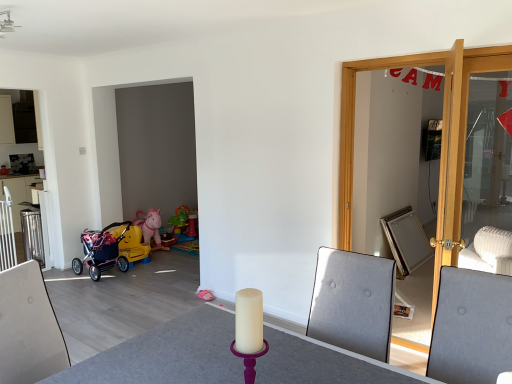
Question: From a real-world perspective, is white matte round table at center positioned under matte white cabinet at upper left based on gravity?

Choices:
 (A) yes
 (B) no

Answer: (A)

Question: Does white matte round table at center have a greater height compared to matte white cabinet at upper left?

Choices:
 (A) yes
 (B) no

Answer: (B)

Question: Is white matte round table at center oriented towards matte white cabinet at upper left?

Choices:
 (A) yes
 (B) no

Answer: (B)

Question: Is white matte round table at center bigger than matte white cabinet at upper left?

Choices:
 (A) no
 (B) yes

Answer: (B)

Question: Is matte white cabinet at upper left completely or partially inside white matte round table at center?

Choices:
 (A) yes
 (B) no

Answer: (B)

Question: Is point (471, 195) positioned closer to the camera than point (12, 135)?

Choices:
 (A) farther
 (B) closer

Answer: (A)

Question: From a real-world perspective, is light wood door at right positioned above or below matte white cabinet at upper left?

Choices:
 (A) below
 (B) above

Answer: (A)

Question: In the image, is light wood door at right positioned in front of or behind matte white cabinet at upper left?

Choices:
 (A) front
 (B) behind

Answer: (A)

Question: From the image's perspective, is light wood door at right positioned above or below matte white cabinet at upper left?

Choices:
 (A) above
 (B) below

Answer: (B)

Question: Is matte white cabinet at upper left wider or thinner than gray fabric swivel chair at right?

Choices:
 (A) wide
 (B) thin

Answer: (B)

Question: Based on their sizes in the image, would you say matte white cabinet at upper left is bigger or smaller than gray fabric swivel chair at right?

Choices:
 (A) small
 (B) big

Answer: (A)

Question: Would you say matte white cabinet at upper left is inside or outside gray fabric swivel chair at right?

Choices:
 (A) outside
 (B) inside

Answer: (A)

Question: Is matte white cabinet at upper left taller or shorter than gray fabric swivel chair at right?

Choices:
 (A) tall
 (B) short

Answer: (A)

Question: From the image's perspective, is gray fabric swivel chair at right located above or below light wood door at right?

Choices:
 (A) below
 (B) above

Answer: (A)

Question: Is gray fabric swivel chair at right situated inside light wood door at right or outside?

Choices:
 (A) outside
 (B) inside

Answer: (A)